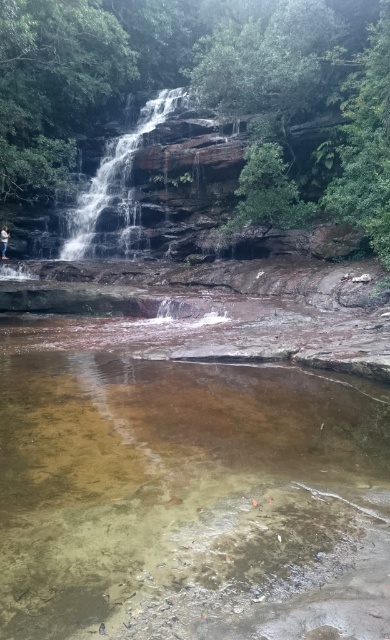
Question: Can you confirm if clear water at center is thinner than white cotton shirt at lower left?

Choices:
 (A) no
 (B) yes

Answer: (A)

Question: Is clear water at center bigger than white cotton shirt at lower left?

Choices:
 (A) no
 (B) yes

Answer: (B)

Question: Estimate the real-world distances between objects in this image. Which object is farther from the smooth brown rock at center?

Choices:
 (A) clear water at center
 (B) white cotton shirt at lower left

Answer: (A)

Question: Estimate the real-world distances between objects in this image. Which object is farther from the white cotton shirt at lower left?

Choices:
 (A) smooth brown rock at center
 (B) clear water at center

Answer: (B)

Question: Does smooth brown rock at center lie behind white cotton shirt at lower left?

Choices:
 (A) no
 (B) yes

Answer: (B)

Question: Considering the real-world distances, which object is farthest from the clear water at center?

Choices:
 (A) white cotton shirt at lower left
 (B) smooth brown rock at center

Answer: (B)